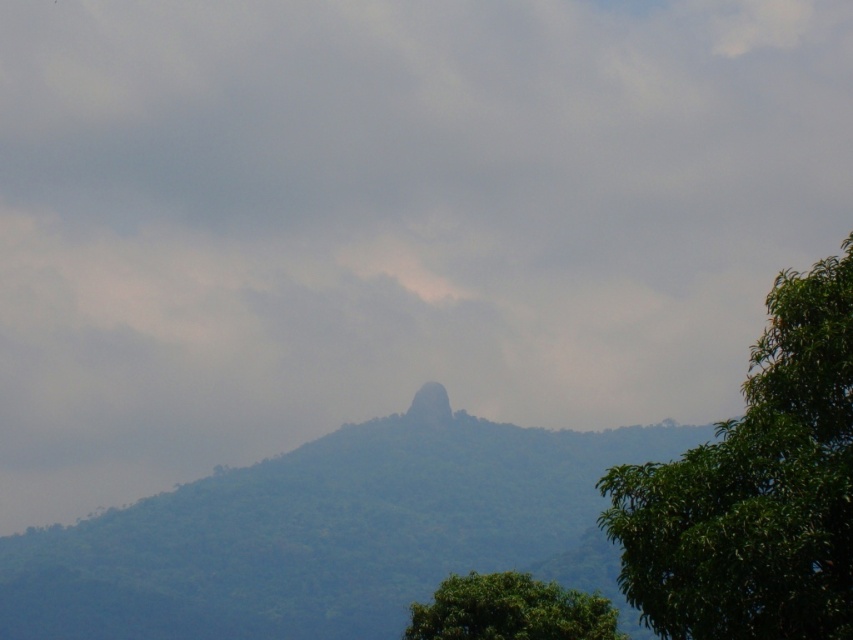
In the scene shown: Is green leafy mountain at center above smooth rock at center?

Actually, green leafy mountain at center is below smooth rock at center.

Who is more distant from viewer, [386,604] or [416,406]?

Point [416,406]

This screenshot has height=640, width=853. I want to click on green leafy mountain at center, so click(329, 534).

Between point (763, 474) and point (595, 611), which one is positioned in front?

Point (763, 474) is in front.

Does point (851, 273) lie behind point (482, 605)?

No, (851, 273) is closer to viewer.

The height and width of the screenshot is (640, 853). I want to click on green leafy tree at right, so [755, 488].

Measure the distance between point (772,433) and camera.

Point (772,433) and camera are 26.89 meters apart from each other.

The width and height of the screenshot is (853, 640). Identify the location of green leafy tree at right. (755, 488).